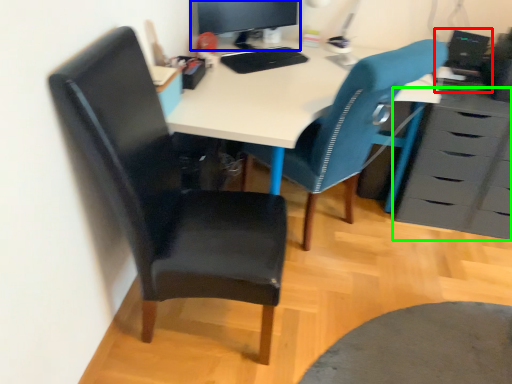
Question: Estimate the real-world distances between objects in this image. Which object is closer to computer (highlighted by a red box), computer monitor (highlighted by a blue box) or chest of drawers (highlighted by a green box)?

Choices:
 (A) computer monitor
 (B) chest of drawers

Answer: (B)